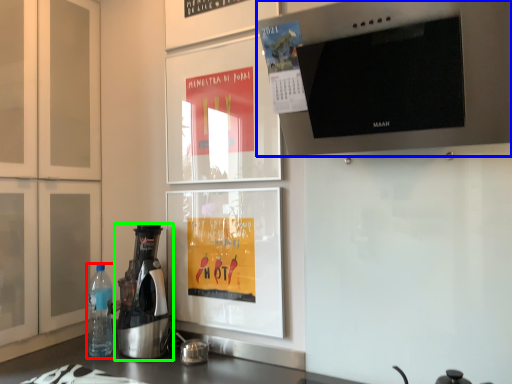
Question: Considering the real-world distances, which object is farthest from bottle (highlighted by a red box)? home appliance (highlighted by a blue box) or kitchen appliance (highlighted by a green box)?

Choices:
 (A) home appliance
 (B) kitchen appliance

Answer: (A)